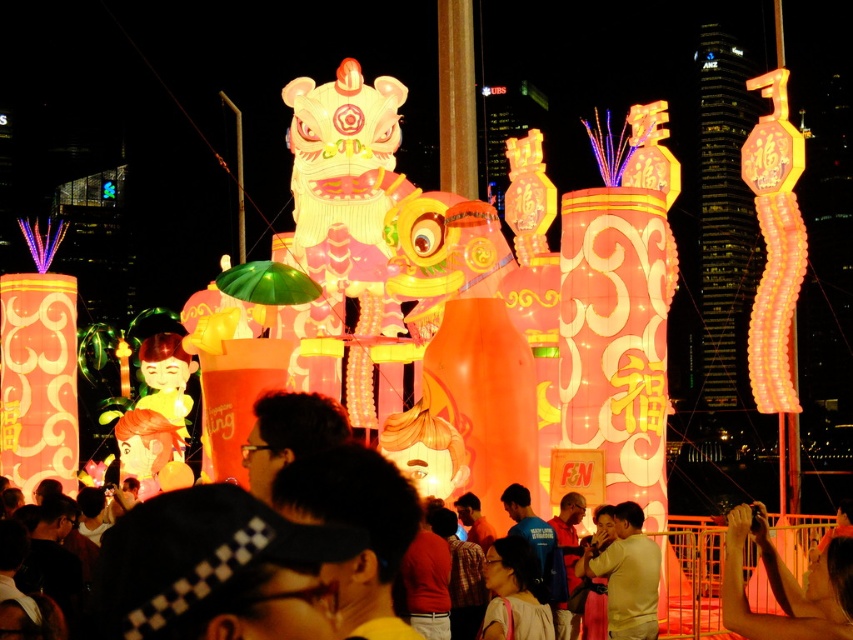
Which of these two, smooth skin arm at center or matte pink dress at center, stands shorter?

matte pink dress at center

Is smooth skin arm at center to the right of matte pink dress at center from the viewer's perspective?

Indeed, smooth skin arm at center is positioned on the right side of matte pink dress at center.

Who is more forward, (741, 592) or (631, 588)?

Positioned in front is point (741, 592).

Where is `smooth skin arm at center`? The width and height of the screenshot is (853, 640). smooth skin arm at center is located at coordinates (786, 586).